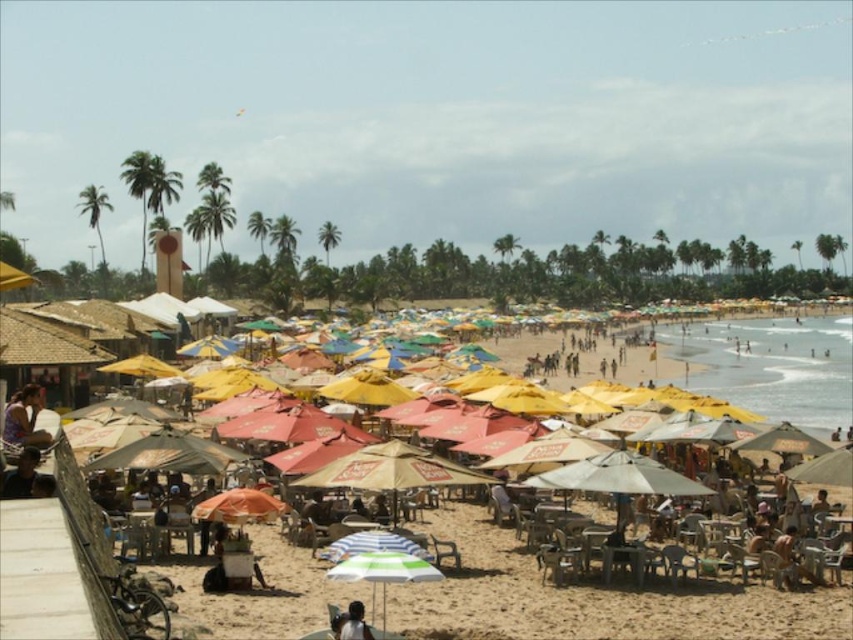
You are a photographer trying to capture the beach scene. You want to include both the green leafy palm tree at upper left and the green leafy palm tree at center in your shot. Which palm tree should you focus on to ensure it appears larger in the photo?

The green leafy palm tree at upper left is bigger than the green leafy palm tree at center, so focusing on it will make it appear larger in the photo.

You are a bird flying over the beach and want to land on the tallest palm tree. Which one should you choose between the green leafy palm tree at upper left and the green leafy palm tree at center?

The green leafy palm tree at upper left is taller than the green leafy palm tree at center, so you should choose the green leafy palm tree at upper left to land on.